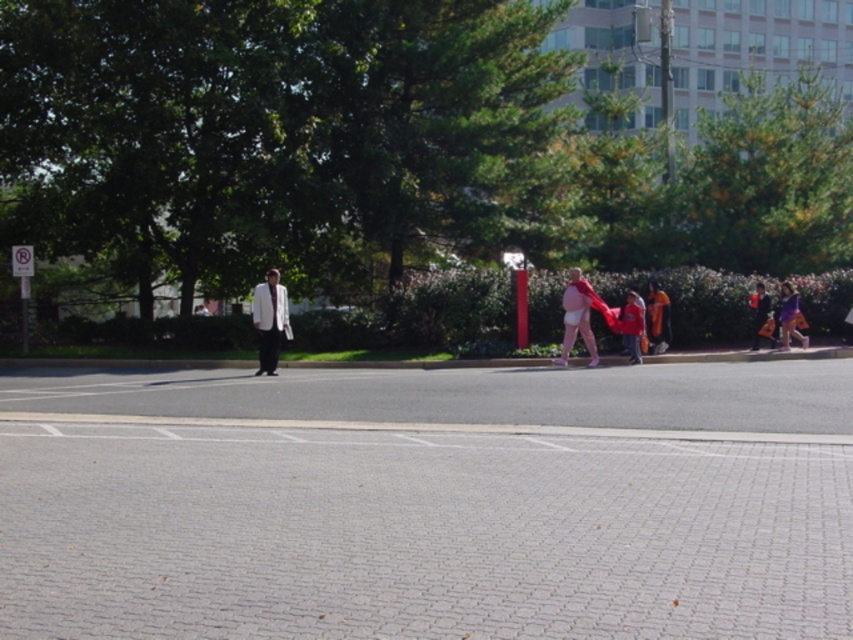
Does matte pink diaper at center lie behind denim jacket at lower right?

No, it is in front of denim jacket at lower right.

Is matte pink diaper at center above denim jacket at lower right?

Correct, matte pink diaper at center is located above denim jacket at lower right.

You are a GUI agent. You are given a task and a screenshot of the screen. Output one action in this format:
    pyautogui.click(x=<x>, y=<y>)
    Task: Click on the matte pink diaper at center
    The image size is (853, 640).
    Given the screenshot: What is the action you would take?
    pyautogui.click(x=576, y=321)

The width and height of the screenshot is (853, 640). What are the coordinates of `matte pink diaper at center` in the screenshot? It's located at click(576, 321).

Who is shorter, gray brick pavement at center or denim jacket at lower right?

With less height is gray brick pavement at center.

Locate an element on the screen. The image size is (853, 640). gray brick pavement at center is located at coordinates (428, 504).

Looking at this image, does red cotton shirt at center have a greater height compared to purple fabric bag at right?

Incorrect, red cotton shirt at center's height is not larger of purple fabric bag at right's.

Who is positioned more to the right, red cotton shirt at center or purple fabric bag at right?

Positioned to the right is purple fabric bag at right.

Find the location of a particular element. This screenshot has height=640, width=853. red cotton shirt at center is located at coordinates (631, 324).

Find the location of a particular element. This screenshot has height=640, width=853. red cotton shirt at center is located at coordinates (631, 324).